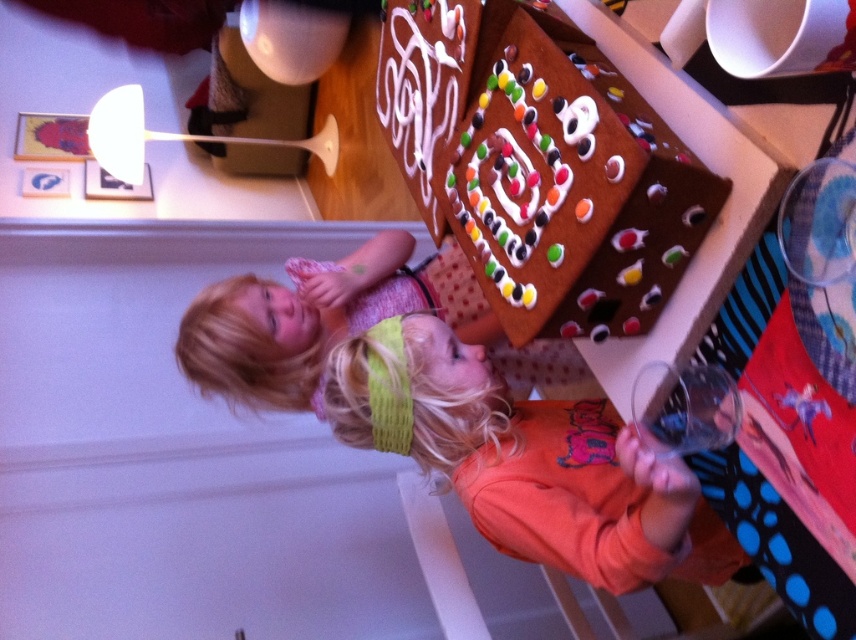
Question: Is chocolate frosted gingerbread house at upper center above orange fleece sweatshirt at center?

Choices:
 (A) yes
 (B) no

Answer: (A)

Question: Among these points, which one is farthest from the camera?

Choices:
 (A) (501, 472)
 (B) (643, 301)

Answer: (A)

Question: Does chocolate frosted gingerbread house at upper center appear on the left side of orange fleece sweatshirt at center?

Choices:
 (A) yes
 (B) no

Answer: (A)

Question: In this image, where is chocolate frosted gingerbread house at upper center located relative to orange fleece sweatshirt at center?

Choices:
 (A) above
 (B) below

Answer: (A)